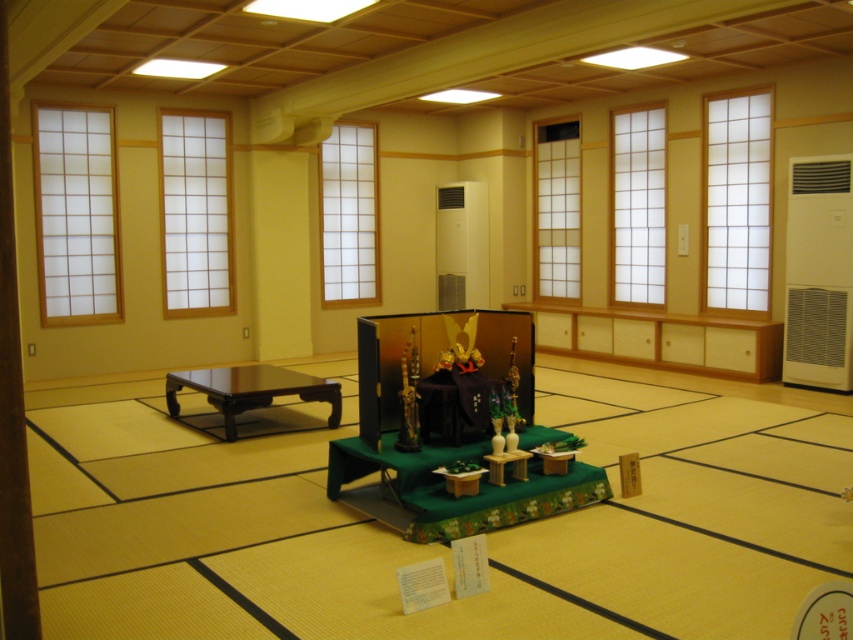
Question: Is brown wooden pillar at left smaller than glossy wood table at center?

Choices:
 (A) yes
 (B) no

Answer: (A)

Question: Does brown wooden pillar at left have a greater width compared to glossy wood table at center?

Choices:
 (A) no
 (B) yes

Answer: (A)

Question: Does brown wooden pillar at left have a greater width compared to glossy wood table at center?

Choices:
 (A) yes
 (B) no

Answer: (B)

Question: Which point is farther from the camera taking this photo?

Choices:
 (A) (225, 422)
 (B) (27, 600)

Answer: (A)

Question: Which of the following is the closest to the observer?

Choices:
 (A) brown wooden pillar at left
 (B) glossy wood table at center

Answer: (A)

Question: Which object is closer to the camera taking this photo?

Choices:
 (A) glossy wood table at center
 (B) brown wooden pillar at left

Answer: (B)